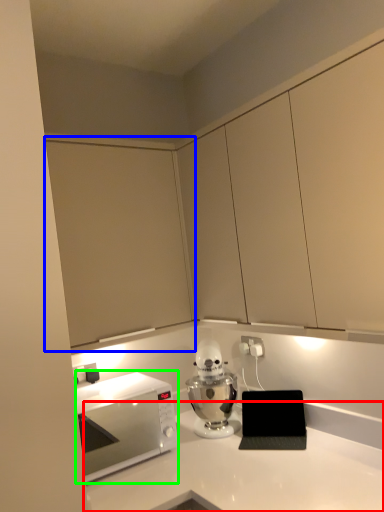
Question: Estimate the real-world distances between objects in this image. Which object is closer to countertop (highlighted by a red box), cabinetry (highlighted by a blue box) or microwave oven (highlighted by a green box)?

Choices:
 (A) cabinetry
 (B) microwave oven

Answer: (B)